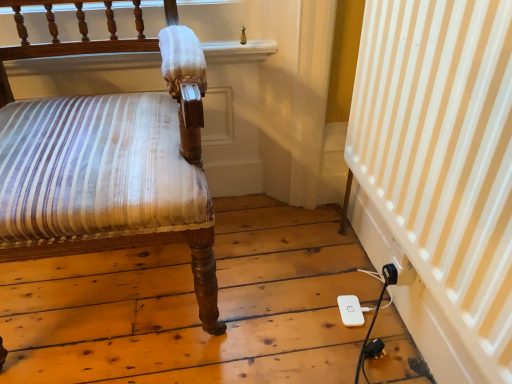
At what (x,y) coordinates should I click in order to perform the action: click on free region on the left part of white striped curtain at lower right. Please return your answer as a coordinate pair (x, y). The height and width of the screenshot is (384, 512). Looking at the image, I should click on (284, 312).